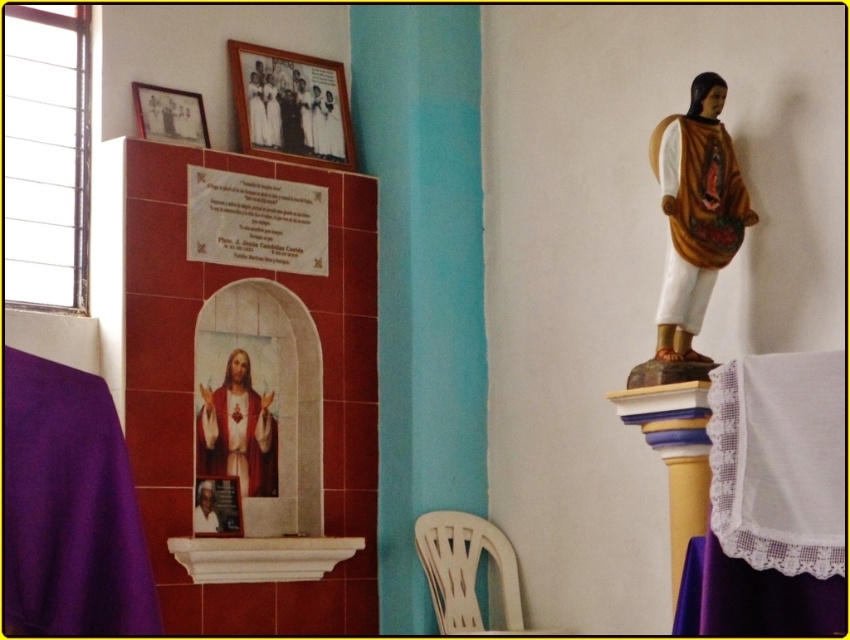
Question: Which point is farther from the camera taking this photo?

Choices:
 (A) (710, 209)
 (B) (197, 529)

Answer: (B)

Question: Estimate the real-world distances between objects in this image. Which object is farther from the matte black photo frame at upper center?

Choices:
 (A) matte gold robe at upper center
 (B) white plastic chair at lower center

Answer: (B)

Question: Which object appears farthest from the camera in this image?

Choices:
 (A) smooth white statue at upper right
 (B) matte black photo frame at upper center
 (C) smooth wooden crucifix at center
 (D) matte gold robe at upper center

Answer: (D)

Question: Is matte black photo frame at upper center closer to camera compared to smooth wooden crucifix at center?

Choices:
 (A) yes
 (B) no

Answer: (B)

Question: Is white plastic chair at lower center positioned at the back of smooth wooden crucifix at center?

Choices:
 (A) no
 (B) yes

Answer: (B)

Question: Does smooth white statue at upper right have a larger size compared to white matte robe at upper center?

Choices:
 (A) no
 (B) yes

Answer: (A)